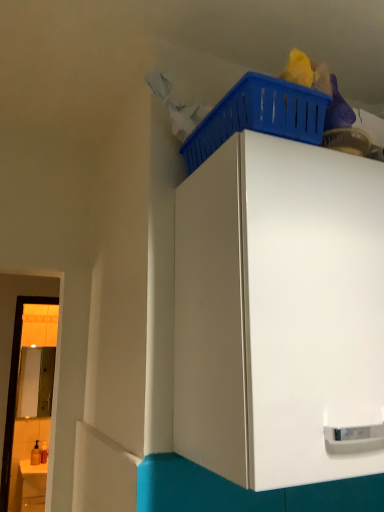
Question: From a real-world perspective, is blue plastic basket at upper right below white glossy cabinet at upper center?

Choices:
 (A) yes
 (B) no

Answer: (B)

Question: From the image's perspective, is blue plastic basket at upper right located beneath white glossy cabinet at upper center?

Choices:
 (A) yes
 (B) no

Answer: (B)

Question: Is blue plastic basket at upper right looking in the opposite direction of white glossy cabinet at upper center?

Choices:
 (A) yes
 (B) no

Answer: (B)

Question: Does blue plastic basket at upper right touch white glossy cabinet at upper center?

Choices:
 (A) yes
 (B) no

Answer: (B)

Question: Is blue plastic basket at upper right positioned far away from white glossy cabinet at upper center?

Choices:
 (A) no
 (B) yes

Answer: (A)

Question: Considering the relative positions of blue plastic basket at upper right and white glossy cabinet at upper center in the image provided, is blue plastic basket at upper right to the right of white glossy cabinet at upper center from the viewer's perspective?

Choices:
 (A) no
 (B) yes

Answer: (A)

Question: From a real-world perspective, is matte white counter at lower left over blue plastic basket at upper right?

Choices:
 (A) no
 (B) yes

Answer: (A)

Question: Is matte white counter at lower left facing away from blue plastic basket at upper right?

Choices:
 (A) yes
 (B) no

Answer: (B)

Question: Can you confirm if matte white counter at lower left is positioned to the left of blue plastic basket at upper right?

Choices:
 (A) yes
 (B) no

Answer: (A)

Question: Can you confirm if matte white counter at lower left is thinner than blue plastic basket at upper right?

Choices:
 (A) no
 (B) yes

Answer: (A)

Question: Does matte white counter at lower left contain blue plastic basket at upper right?

Choices:
 (A) yes
 (B) no

Answer: (B)

Question: From a real-world perspective, is matte white counter at lower left under blue plastic basket at upper right?

Choices:
 (A) yes
 (B) no

Answer: (A)

Question: Does white glossy cabinet at upper center lie behind matte white counter at lower left?

Choices:
 (A) no
 (B) yes

Answer: (A)